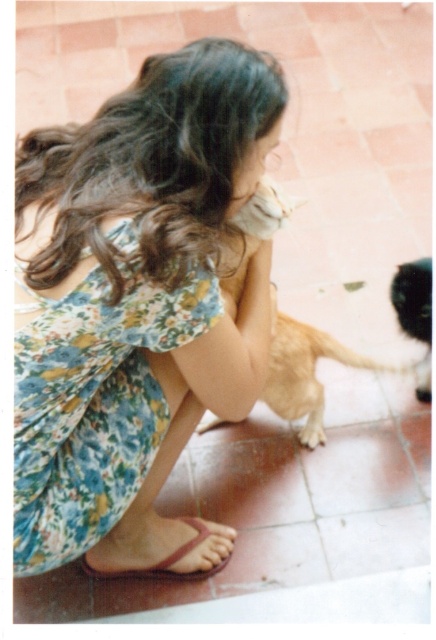
You are a photographer trying to capture the interaction between the floral fabric dress at center and the golden fur dog at center. Since the dress is thinner than the dog, how might this affect your composition?

The floral fabric dress at center is thinner than the golden fur dog at center, so you can position the dress closer to the camera to emphasize its delicate appearance while ensuring the dog remains a focal point in the frame.

You are a photographer setting up a camera at eye level. You want to capture both the floral fabric dress at center and the pink leather sandal at lower center in the same frame. Based on their heights, which object should you focus on first to ensure both are in focus?

The floral fabric dress at center is taller than the pink leather sandal at lower center, so you should focus on the floral fabric dress at center first to ensure both are in focus since it is taller and likely further away.